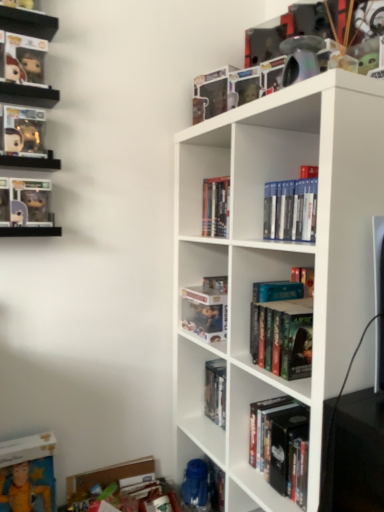
Question: From the image's perspective, is clear plastic figurines at upper left, which is counted as the 1th shelf, starting from the back, located above or below hardcover book at center, which is the fourth book from right to left?

Choices:
 (A) above
 (B) below

Answer: (A)

Question: Considering the positions of point (33, 15) and point (205, 402), is point (33, 15) closer or farther from the camera than point (205, 402)?

Choices:
 (A) farther
 (B) closer

Answer: (B)

Question: Based on their relative distances, which object is nearer to the clear plastic figurines at upper left, acting as the second shelf starting from the front?

Choices:
 (A) white matte bookshelf at center, which ranks as the second shelf in top-to-bottom order
 (B) hardcover books at center, the 4th book positioned from the left
 (C) metallic rainbow pipe at upper right
 (D) matte gold figurine at upper left, which is counted as the eighth book, starting from the right
 (E) translucent plastic figure at upper center, placed as the third book when sorted from left to right

Answer: (D)

Question: Which object is the closest to the white matte bookshelf at center, which is the first shelf from bottom to top?

Choices:
 (A) metallic rainbow pipe at upper right
 (B) hardcover books at center, the 6th book from the left
 (C) translucent plastic figure at upper center, the sixth book viewed from the right
 (D) matte gold figurine at upper left, which is counted as the eighth book, starting from the right
 (E) matte black figurine at upper left, placed as the seventh book when sorted from right to left

Answer: (C)